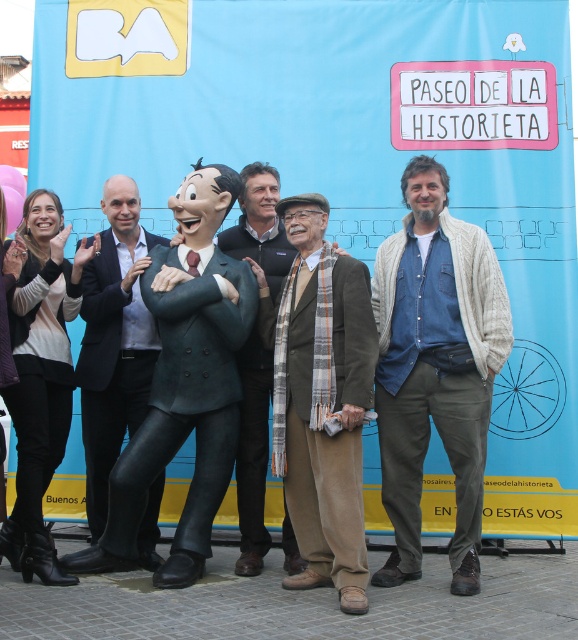
Who is more distant from viewer, (313, 332) or (90, 536)?

Positioned behind is point (90, 536).

Which is below, brown woolen suit at center or dark green suit at center?

brown woolen suit at center is below.

Which is in front, point (334, 531) or point (99, 467)?

Positioned in front is point (334, 531).

Identify the location of brown woolen suit at center. The height and width of the screenshot is (640, 578). point(323,408).

Between denim shirt at center and brown woolen suit at center, which one is positioned higher?

denim shirt at center is above.

What do you see at coordinates (435, 368) in the screenshot? This screenshot has height=640, width=578. I see `denim shirt at center` at bounding box center [435, 368].

Find the location of `denim shirt at center`. denim shirt at center is located at coordinates (435, 368).

Describe the element at coordinates (184, 385) in the screenshot. I see `matte green suit at center` at that location.

Is matte green suit at center further to camera compared to brown wool scarf at center?

No, it is in front of brown wool scarf at center.

Where is `matte green suit at center`? This screenshot has height=640, width=578. matte green suit at center is located at coordinates (184, 385).